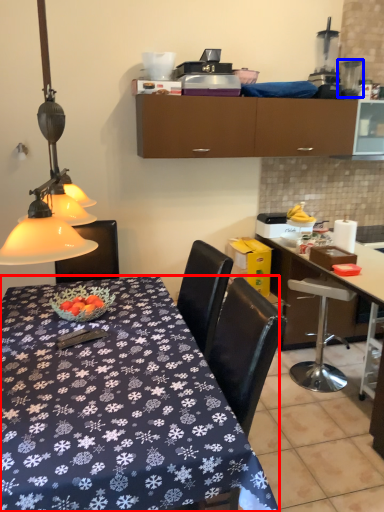
Question: Which object is closer to the camera taking this photo, desk (highlighted by a red box) or appliance (highlighted by a blue box)?

Choices:
 (A) desk
 (B) appliance

Answer: (A)